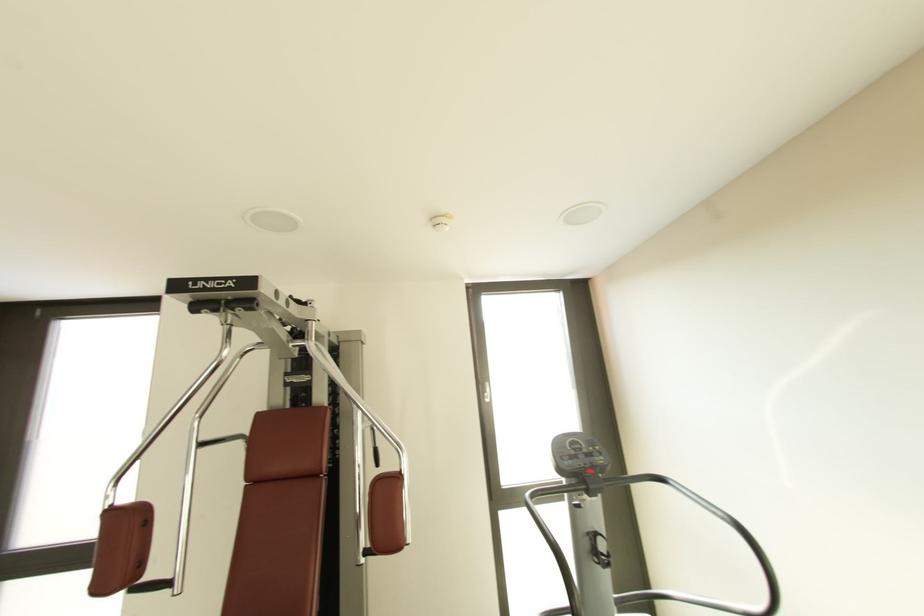
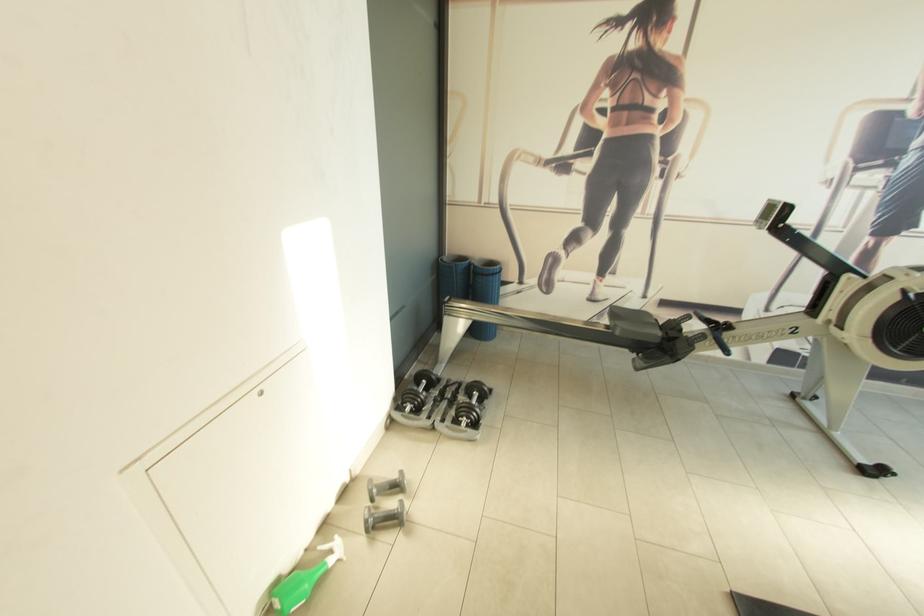
The images are taken continuously from a first-person perspective. In which direction is your viewpoint rotating?

The camera's rotation is toward left-down.